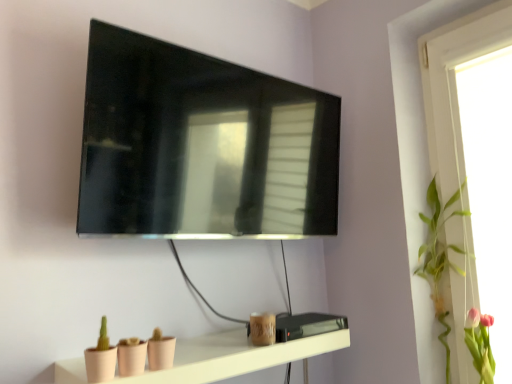
Question: Is matte black tv at upper center positioned behind green leafy plant at upper right?

Choices:
 (A) no
 (B) yes

Answer: (A)

Question: Are matte black tv at upper center and green leafy plant at upper right making contact?

Choices:
 (A) yes
 (B) no

Answer: (B)

Question: Considering the relative sizes of matte black tv at upper center and green leafy plant at upper right in the image provided, is matte black tv at upper center smaller than green leafy plant at upper right?

Choices:
 (A) no
 (B) yes

Answer: (A)

Question: Considering the relative sizes of matte black tv at upper center and green leafy plant at upper right in the image provided, is matte black tv at upper center thinner than green leafy plant at upper right?

Choices:
 (A) yes
 (B) no

Answer: (A)

Question: Is green leafy plant at upper right at the back of matte black tv at upper center?

Choices:
 (A) yes
 (B) no

Answer: (B)

Question: Is matte black tv at upper center aimed at green leafy plant at upper right?

Choices:
 (A) no
 (B) yes

Answer: (B)

Question: Is pink silk flower at upper right looking in the opposite direction of matte black tv at upper center?

Choices:
 (A) yes
 (B) no

Answer: (B)

Question: Would you consider pink silk flower at upper right to be distant from matte black tv at upper center?

Choices:
 (A) yes
 (B) no

Answer: (B)

Question: Is pink silk flower at upper right surrounding matte black tv at upper center?

Choices:
 (A) yes
 (B) no

Answer: (B)

Question: Is pink silk flower at upper right further to the viewer compared to matte black tv at upper center?

Choices:
 (A) no
 (B) yes

Answer: (B)

Question: Are pink silk flower at upper right and matte black tv at upper center beside each other?

Choices:
 (A) no
 (B) yes

Answer: (A)

Question: Considering the relative sizes of pink silk flower at upper right and matte black tv at upper center in the image provided, is pink silk flower at upper right thinner than matte black tv at upper center?

Choices:
 (A) no
 (B) yes

Answer: (A)

Question: Is pink silk flower at upper right located within green leafy plant at upper right?

Choices:
 (A) no
 (B) yes

Answer: (A)